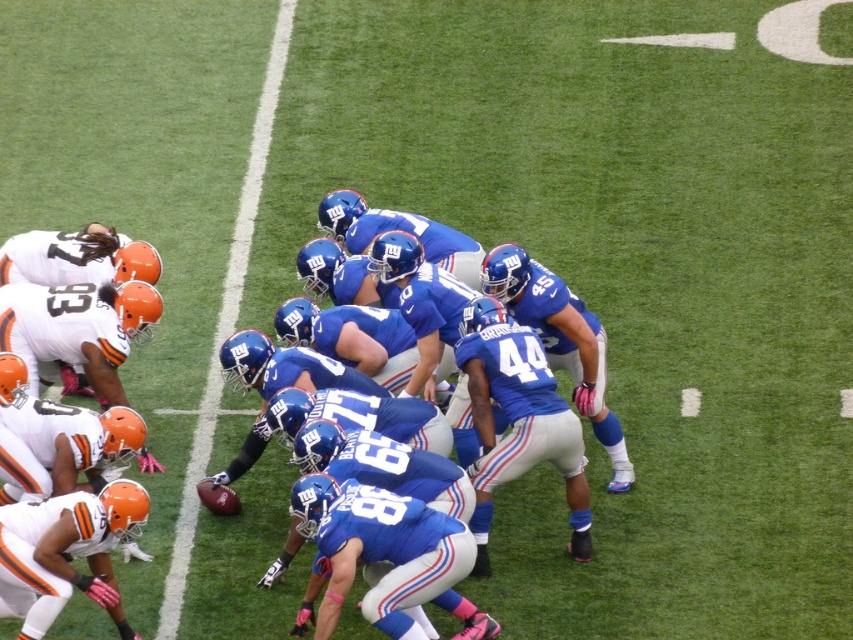
Who is positioned more to the left, white matte uniform at lower left or matte orange helmet at left?

white matte uniform at lower left is more to the left.

This screenshot has height=640, width=853. What do you see at coordinates (96, 288) in the screenshot? I see `white matte uniform at lower left` at bounding box center [96, 288].

Identify the location of white matte uniform at lower left. (96, 288).

From the picture: Is blue fabric jersey at center shorter than matte orange helmet at left?

Yes.

Who is shorter, blue fabric jersey at center or matte orange helmet at left?

Standing shorter between the two is blue fabric jersey at center.

Which is behind, point (315, 314) or point (260, 116)?

Positioned behind is point (260, 116).

Locate an element on the screen. This screenshot has height=640, width=853. blue fabric jersey at center is located at coordinates (334, 339).

Does blue fabric jersey at center have a smaller size compared to white matte uniform at lower left?

Actually, blue fabric jersey at center might be larger than white matte uniform at lower left.

Who is more forward, (311, 308) or (25, 259)?

Point (311, 308) is more forward.

Locate an element on the screen. blue fabric jersey at center is located at coordinates (334, 339).